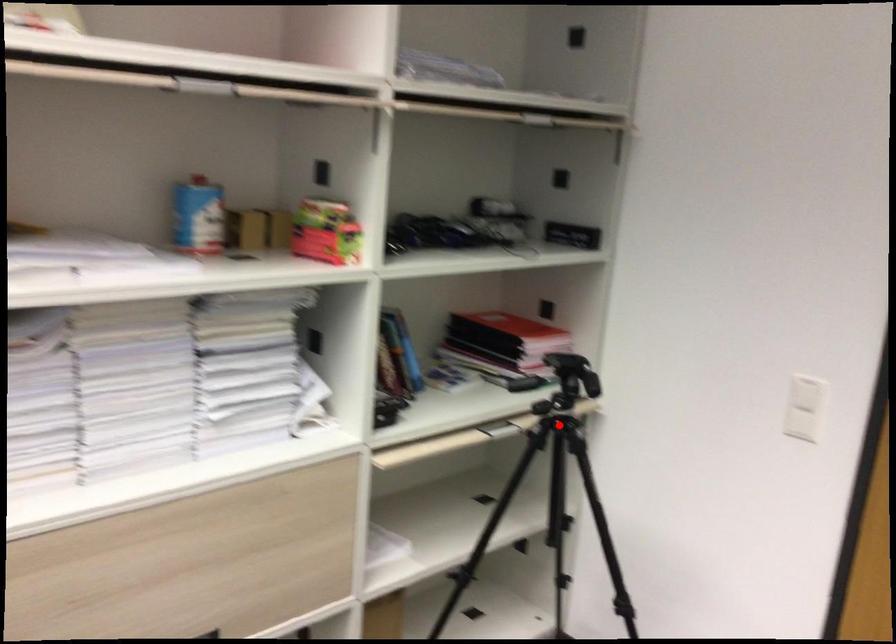
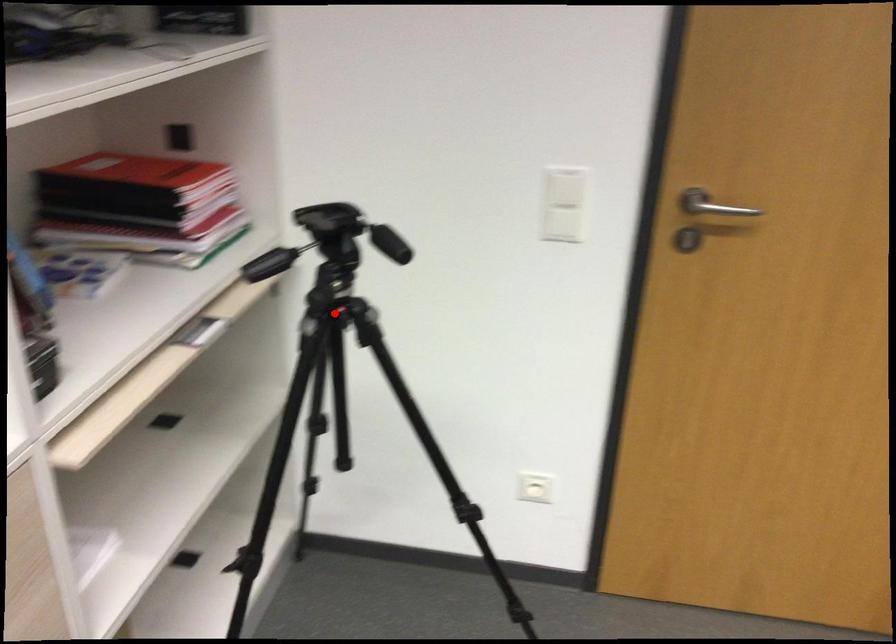
I am providing you with two images of the same scene from different viewpoints. A red point is marked on the first image and another point is marked on the second image. Is the marked point in image1 the same physical position as the marked point in image2?

Yes